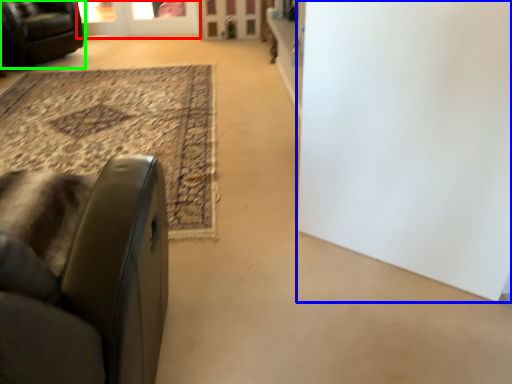
Question: Which is nearer to the screen door (highlighted by a red box)? door (highlighted by a blue box) or chair (highlighted by a green box).

Choices:
 (A) door
 (B) chair

Answer: (B)